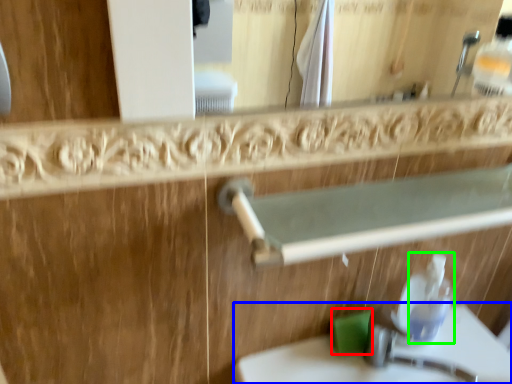
Question: Which object is positioned closest to soap (highlighted by a red box)? Select from sink (highlighted by a blue box) and soap dispenser (highlighted by a green box).

Choices:
 (A) sink
 (B) soap dispenser

Answer: (B)